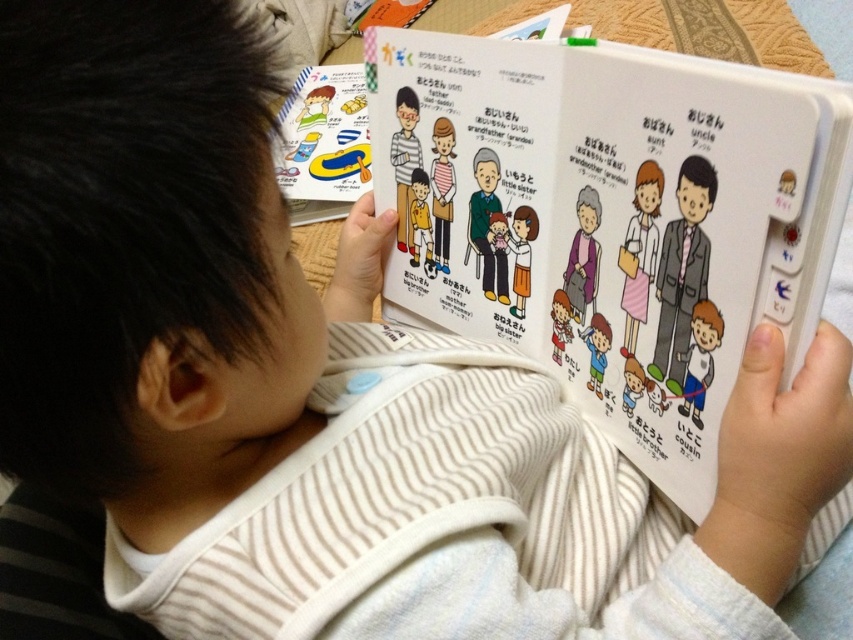
Does white paper book at center appear on the right side of matte white dress at center?

Indeed, white paper book at center is positioned on the right side of matte white dress at center.

Between white paper book at center and matte white dress at center, which one has more height?

white paper book at center is taller.

The height and width of the screenshot is (640, 853). I want to click on white paper book at center, so click(x=616, y=216).

Identify the location of white paper book at center. The width and height of the screenshot is (853, 640). (616, 216).

Is white paper book at center to the right of yellow matte shirt at center from the viewer's perspective?

Yes, white paper book at center is to the right of yellow matte shirt at center.

Between point (666, 275) and point (416, 170), which one is positioned in front?

Point (666, 275) is in front.

Is point (566, 80) closer to camera compared to point (421, 186)?

Yes, it is.

Identify the location of white paper book at center. This screenshot has height=640, width=853. (616, 216).

Between purple fabric at center and matte white dress at center, which one is positioned lower?

matte white dress at center

Does purple fabric at center appear on the right side of matte white dress at center?

Indeed, purple fabric at center is positioned on the right side of matte white dress at center.

You are a GUI agent. You are given a task and a screenshot of the screen. Output one action in this format:
    pyautogui.click(x=<x>, y=<y>)
    Task: Click on the purple fabric at center
    The image size is (853, 640).
    Given the screenshot: What is the action you would take?
    pyautogui.click(x=583, y=256)

You are a GUI agent. You are given a task and a screenshot of the screen. Output one action in this format:
    pyautogui.click(x=<x>, y=<y>)
    Task: Click on the purple fabric at center
    
    Given the screenshot: What is the action you would take?
    pyautogui.click(x=583, y=256)